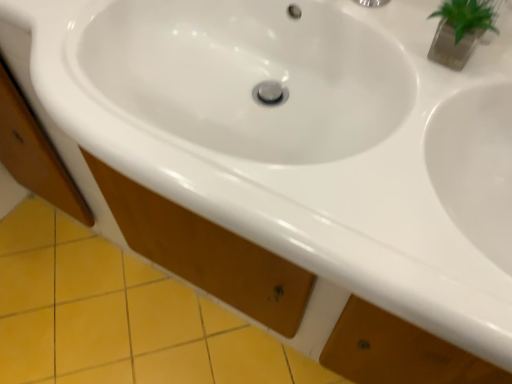
This screenshot has width=512, height=384. What are the coordinates of `blank space to the left of green leafy plant at upper right` in the screenshot? It's located at (388, 34).